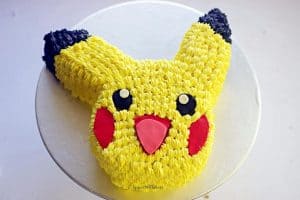
Find the location of a particular element. table is located at coordinates (20, 45), (274, 164).